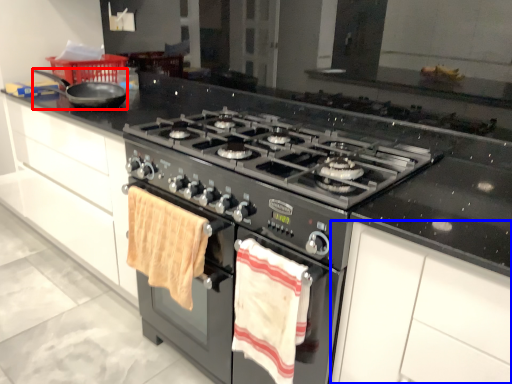
Question: Which of the following is the closest to the observer, frying pan (highlighted by a red box) or cabinetry (highlighted by a blue box)?

Choices:
 (A) frying pan
 (B) cabinetry

Answer: (B)